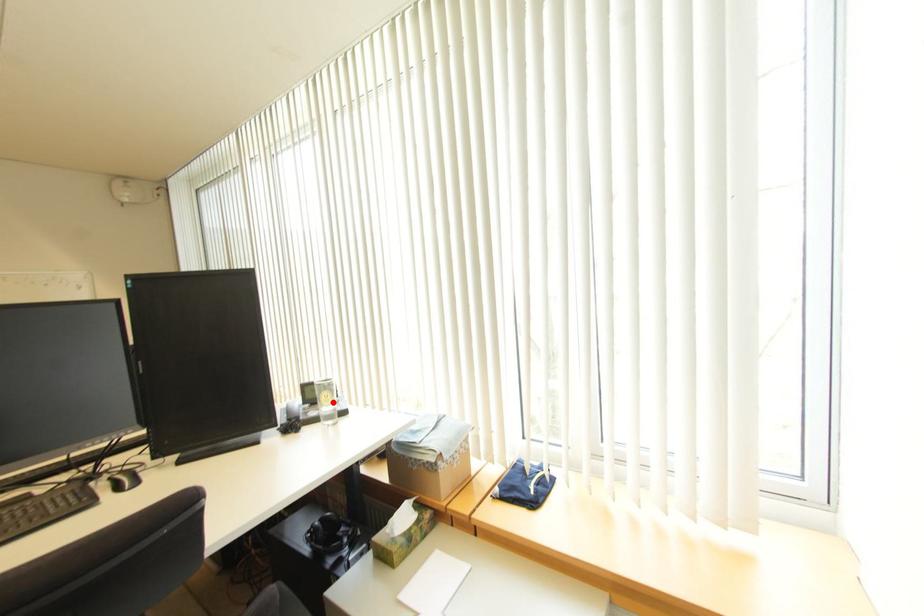
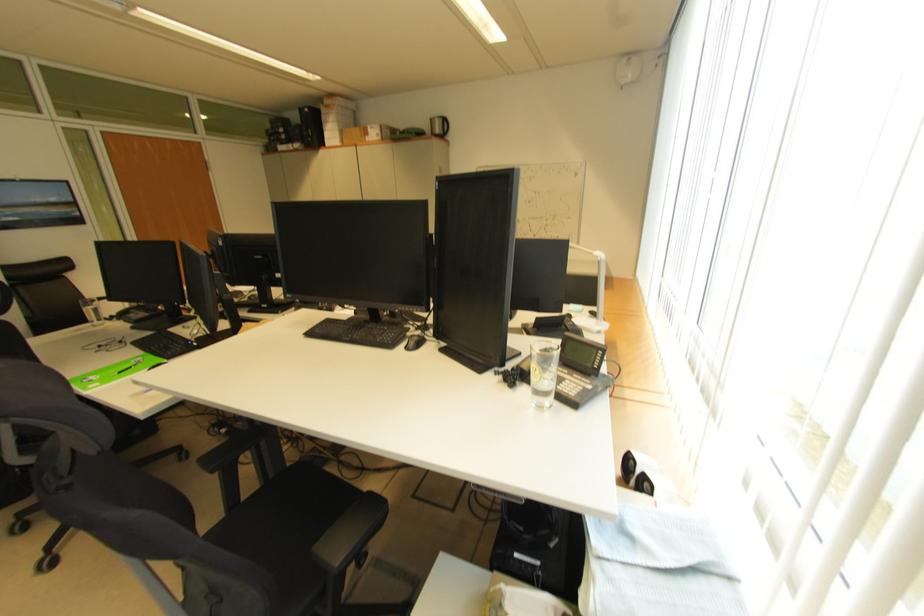
Question: A red point is marked in image1. In image2, is the corresponding 3D point closer to the camera or farther? Reply with the corresponding letter.

Choices:
 (A) The corresponding 3D point is closer.
 (B) The corresponding 3D point is farther.

Answer: (B)